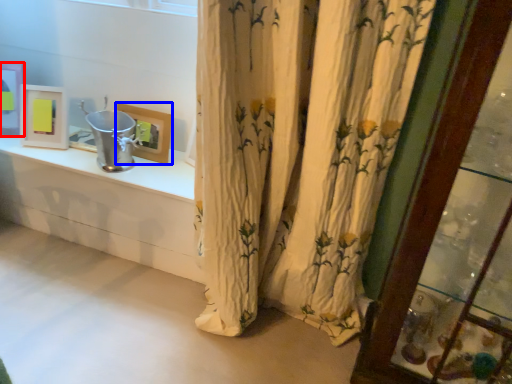
Question: Which point is closer to the camera, picture frame (highlighted by a red box) or picture frame (highlighted by a blue box)?

Choices:
 (A) picture frame
 (B) picture frame

Answer: (B)